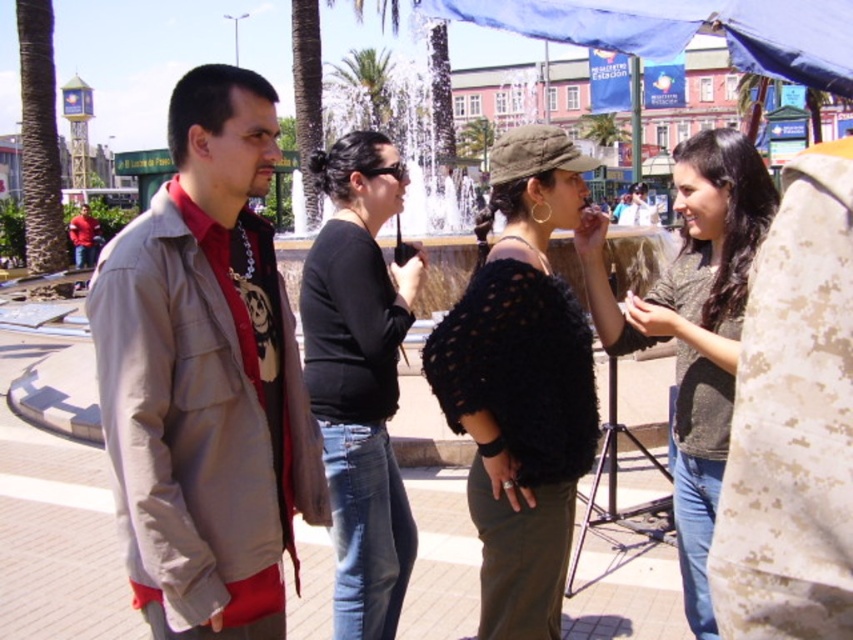
Is point (189, 397) closer to viewer compared to point (76, 232)?

Yes, point (189, 397) is in front of point (76, 232).

Is point (314, 509) more distant than point (84, 246)?

No, it is in front of (84, 246).

Who is more distant from viewer, (206, 289) or (82, 209)?

Point (82, 209)

The image size is (853, 640). Identify the location of matte khaki jacket at left. (206, 378).

Is the position of black knitted sweater at center less distant than that of knitted sweater at center?

Yes, it is in front of knitted sweater at center.

Between black knitted sweater at center and knitted sweater at center, which one appears on the left side from the viewer's perspective?

black knitted sweater at center is more to the left.

Locate an element on the screen. The height and width of the screenshot is (640, 853). black knitted sweater at center is located at coordinates (521, 384).

Based on the photo, does green leafy palm tree at upper center appear over matte red shirt at left?

Yes.

Does green leafy palm tree at upper center appear on the right side of matte red shirt at left?

Yes, green leafy palm tree at upper center is to the right of matte red shirt at left.

Between point (363, 81) and point (70, 230), which one is positioned in front?

Point (70, 230) is in front.

The image size is (853, 640). I want to click on green leafy palm tree at upper center, so click(367, 80).